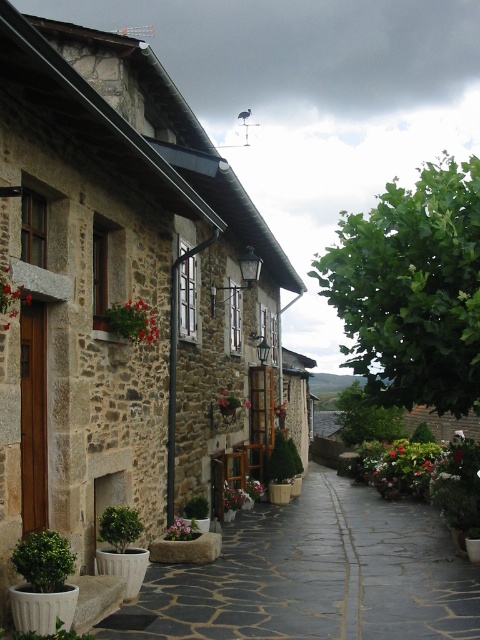
You are standing in front of the stone building and notice two plants at the center of the facade. Which one, the green matte flower at center or the green leafy plant at center, is closer to you?

The green matte flower at center is closer to you because it is positioned in front of the green leafy plant at center.

You are a gardener who needs to water both the stone wall at left and the green leafy plant at center. Given that your watering can holds enough water for 4 meters of watering, can you water both without refilling?

The stone wall at left and green leafy plant at center are 4.45 meters apart. Since the distance exceeds the 4 meters capacity of the watering can, you cannot water both without refilling.

In the scene shown: You are standing on the pathway leading to the stone building and see the green matte potted plant at lower left and the green leafy plant at lower left. Which one is closer to you?

The green matte potted plant at lower left is closer to you because it is further to the viewer than the green leafy plant at lower left.